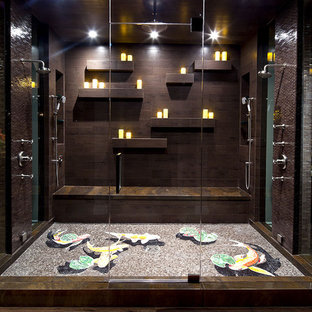
In order to click on ceiling in this screenshot , I will do `click(181, 11)`.